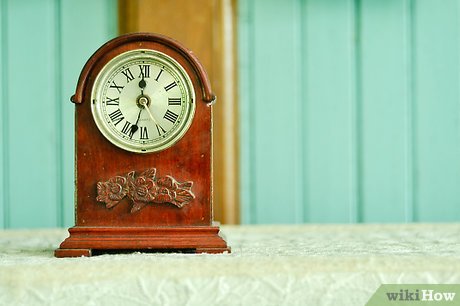
This screenshot has height=306, width=460. I want to click on brown board behind clock, so click(x=179, y=17).